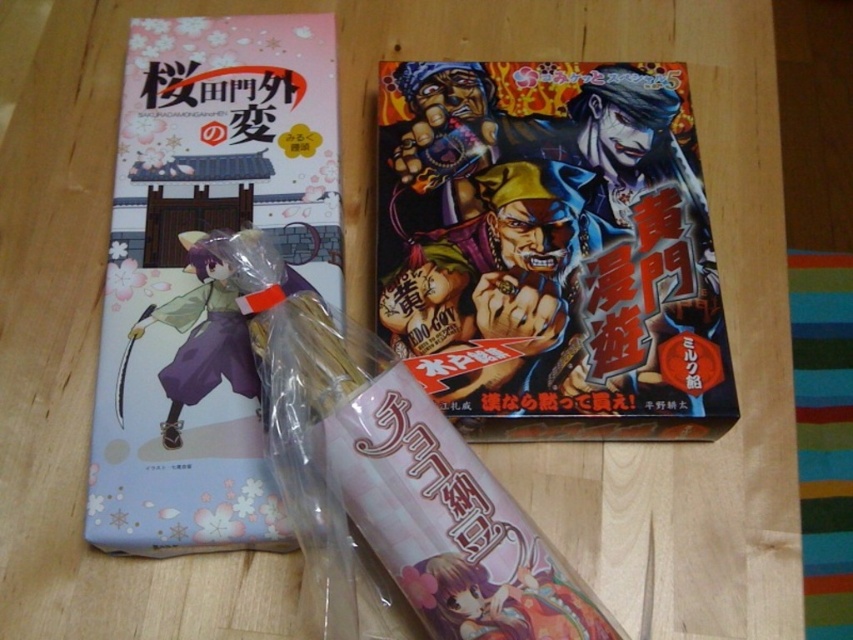
You have a small toy car that is 12 inches long. You want to place it between the matte paper comic book at center and the purple matte figure at center. Will the toy car fit entirely between them without overlapping either object?

The distance between the matte paper comic book at center and the purple matte figure at center is 13.84 inches. Since the toy car is 12 inches long, it will fit entirely between them as there is enough space.

You are a collector who wants to display the matte paper comic book at center on a shelf. The shelf is 1.2 meters away from the viewer. Will the comic book fit on the shelf?

The matte paper comic book at center is 1.18 meters from the viewer, which is slightly closer than the shelf distance of 1.2 meters. Therefore, the comic book will fit on the shelf since it can be placed within the shelf space available.

You are organizing a display shelf and need to place the matte paper comic book at left and the purple matte figure at center. According to the image, which object is positioned to the left of the other?

The purple matte figure at center is positioned to the left of the matte paper comic book at left.